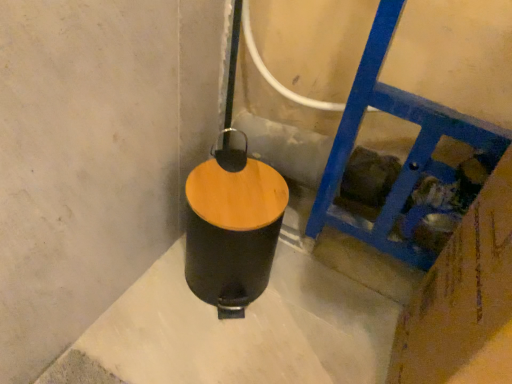
Image resolution: width=512 pixels, height=384 pixels. I want to click on blank space situated above black matte waste container at center (from a real-world perspective), so click(x=239, y=188).